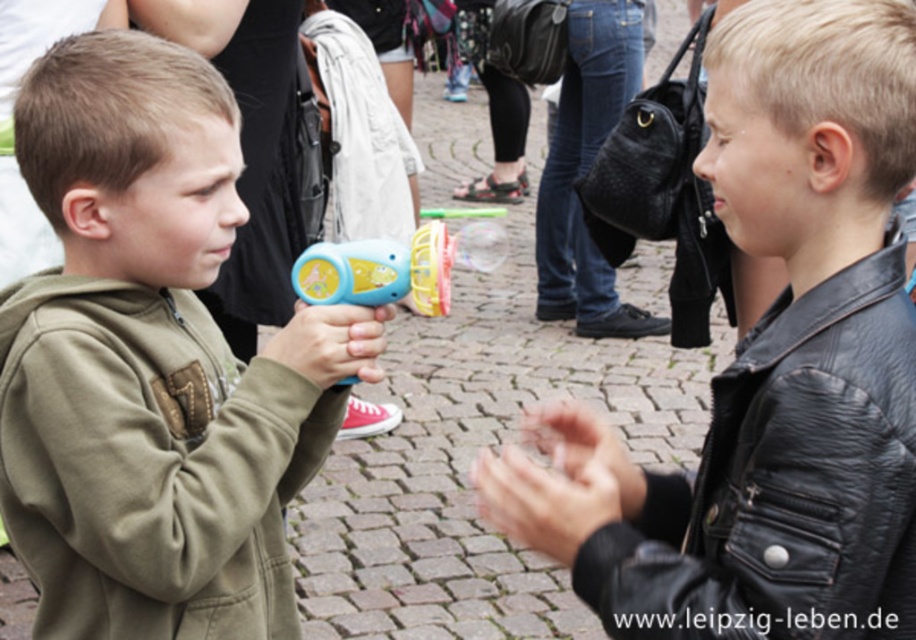
Where is the matte blue toy gun at left located in the image?

The matte blue toy gun at left is located at point [151,362] in the image.

You are a photographer standing at a safe distance. You want to take a closeup photo of the matte blue toy gun at left without moving the boy holding it. Can you adjust your camera zoom to capture the entire toy gun in the frame?

The matte blue toy gun at left is 2.76 meters away from the camera. If your camera has sufficient zoom capability, you can adjust the zoom to capture the entire toy gun in the frame without moving closer.